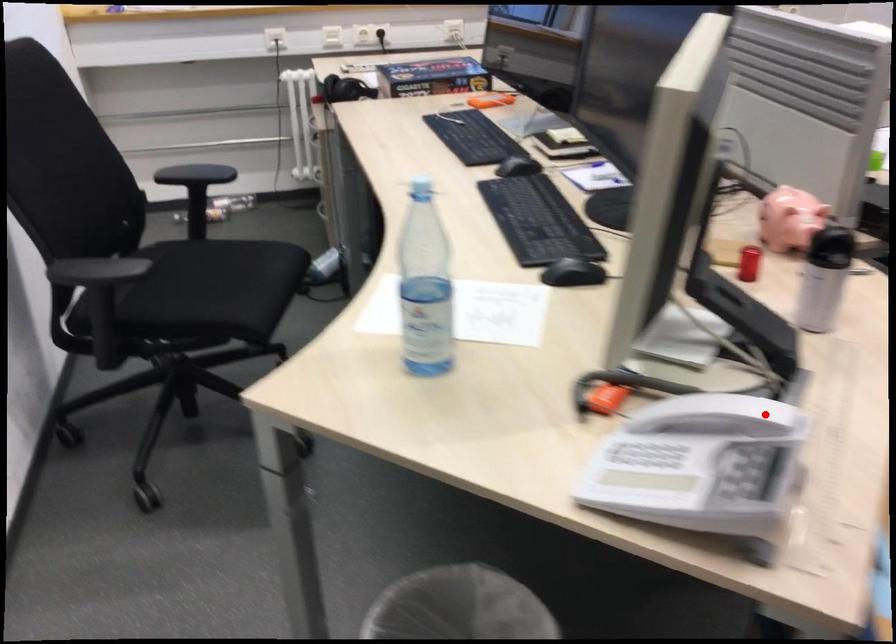
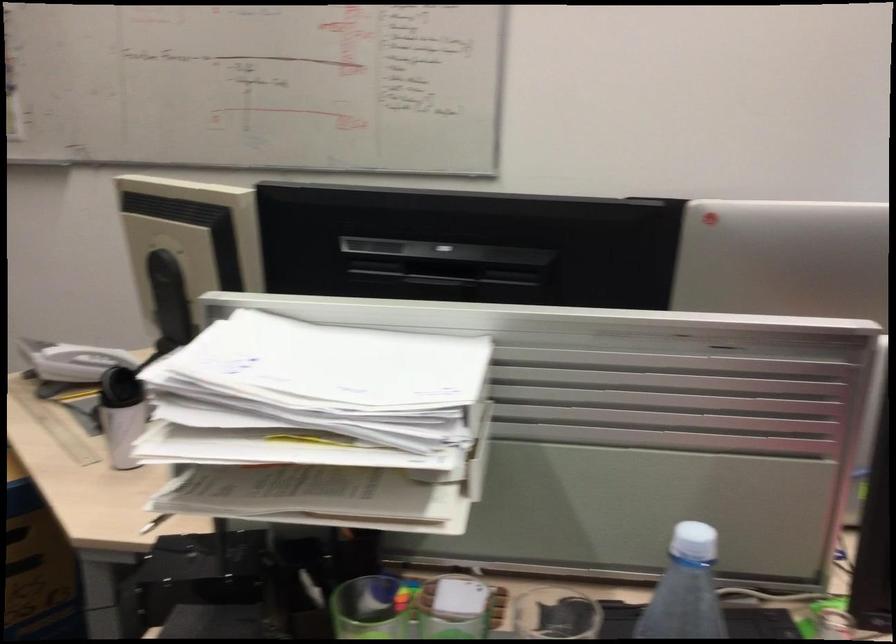
In the second image, find the point that corresponds to the highlighted location in the first image.

(72, 361)